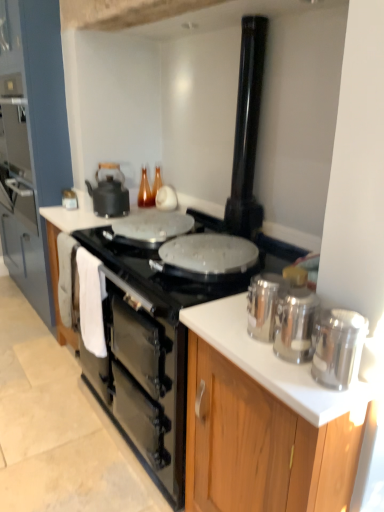
Question: Should I look upward or downward to see white glossy countertop at center?

Choices:
 (A) up
 (B) down

Answer: (B)

Question: From the image's perspective, is white glossy countertop at center above matte black kettle at upper left, acting as the first kitchen appliance starting from the top?

Choices:
 (A) no
 (B) yes

Answer: (A)

Question: From the image's perspective, does white glossy countertop at center appear lower than matte black kettle at upper left, acting as the first kitchen appliance starting from the top?

Choices:
 (A) yes
 (B) no

Answer: (A)

Question: Would you say matte black kettle at upper left, which is the fourth kitchen appliance from bottom to top, is part of white glossy countertop at center's contents?

Choices:
 (A) no
 (B) yes

Answer: (A)

Question: Considering the relative sizes of white glossy countertop at center and matte black kettle at upper left, the first kitchen appliance in the left-to-right sequence, in the image provided, is white glossy countertop at center wider than matte black kettle at upper left, the first kitchen appliance in the left-to-right sequence,?

Choices:
 (A) no
 (B) yes

Answer: (B)

Question: Is white glossy countertop at center directly adjacent to matte black kettle at upper left, acting as the first kitchen appliance starting from the top?

Choices:
 (A) yes
 (B) no

Answer: (B)

Question: Can you confirm if white glossy countertop at center is shorter than matte black kettle at upper left, which is the fourth kitchen appliance from bottom to top?

Choices:
 (A) no
 (B) yes

Answer: (A)

Question: Is the position of polished stainless steel canisters at right, the first kitchen appliance in the bottom-to-top sequence, less distant than that of silver metallic canisters at right, which appears as the first cabinetry when viewed from the front?

Choices:
 (A) no
 (B) yes

Answer: (B)

Question: From a real-world perspective, is polished stainless steel canisters at right, which is the first kitchen appliance in front-to-back order, physically above silver metallic canisters at right, placed as the second cabinetry when sorted from back to front?

Choices:
 (A) no
 (B) yes

Answer: (B)

Question: Can you confirm if polished stainless steel canisters at right, which is the first kitchen appliance in front-to-back order, is wider than silver metallic canisters at right, which appears as the first cabinetry when viewed from the front?

Choices:
 (A) no
 (B) yes

Answer: (A)

Question: Is there a large distance between polished stainless steel canisters at right, placed as the 4th kitchen appliance when sorted from top to bottom, and silver metallic canisters at right, the second cabinetry in the left-to-right sequence?

Choices:
 (A) no
 (B) yes

Answer: (A)

Question: Could you tell me if polished stainless steel canisters at right, the first kitchen appliance positioned from the right, is facing silver metallic canisters at right, the 1th cabinetry when ordered from right to left?

Choices:
 (A) no
 (B) yes

Answer: (A)

Question: Can you confirm if polished stainless steel canisters at right, the first kitchen appliance in the bottom-to-top sequence, is thinner than silver metallic canisters at right, the second cabinetry in the left-to-right sequence?

Choices:
 (A) no
 (B) yes

Answer: (B)

Question: Is silver metallic canisters at right, placed as the second cabinetry when sorted from back to front, inside black matte oven at center?

Choices:
 (A) yes
 (B) no

Answer: (B)